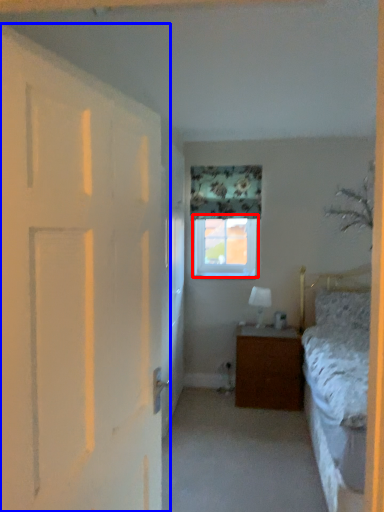
Question: Which object appears closest to the camera in this image, window (highlighted by a red box) or door (highlighted by a blue box)?

Choices:
 (A) window
 (B) door

Answer: (B)